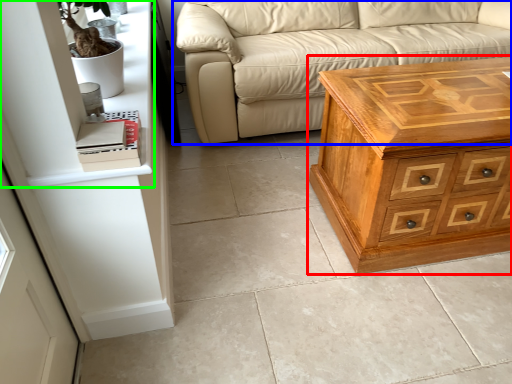
Question: Which object is positioned farthest from chest of drawers (highlighted by a red box)? Select from studio couch (highlighted by a blue box) and shelf (highlighted by a green box).

Choices:
 (A) studio couch
 (B) shelf

Answer: (B)